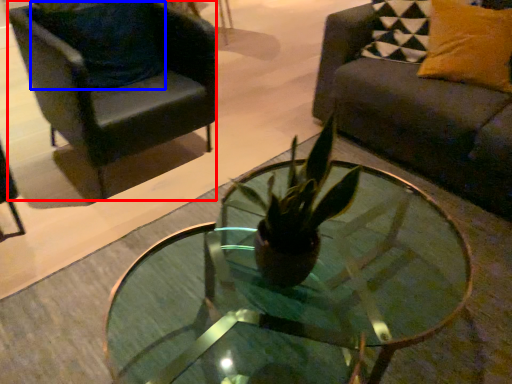
Question: Which object is closer to the camera taking this photo, chair (highlighted by a red box) or pillow (highlighted by a blue box)?

Choices:
 (A) chair
 (B) pillow

Answer: (A)